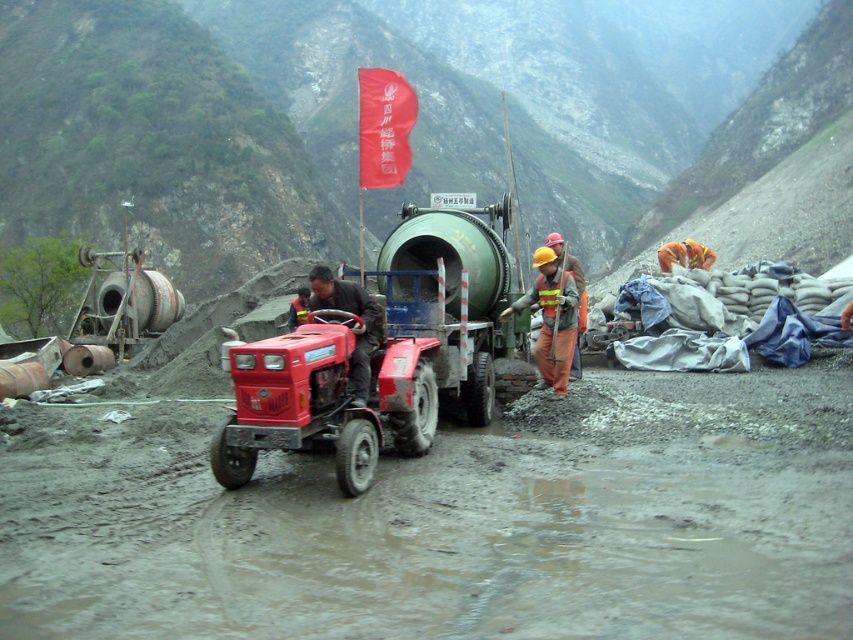
Which of these two, red matte tractor at center or red fabric flag at upper center, stands shorter?

red matte tractor at center

Which is above, red matte tractor at center or red fabric flag at upper center?

red fabric flag at upper center

Between point (247, 392) and point (364, 96), which one is positioned behind?

Point (364, 96)

At what (x,y) coordinates should I click in order to perform the action: click on red matte tractor at center. Please return your answer as a coordinate pair (x, y). The height and width of the screenshot is (640, 853). Looking at the image, I should click on (384, 356).

Is red fabric flag at upper center bigger than yellow reflective safety vest at center?

Correct, red fabric flag at upper center is larger in size than yellow reflective safety vest at center.

Who is lower down, red fabric flag at upper center or yellow reflective safety vest at center?

Positioned lower is yellow reflective safety vest at center.

What are the coordinates of `red fabric flag at upper center` in the screenshot? It's located at (384, 125).

This screenshot has height=640, width=853. Identify the location of red fabric flag at upper center. (384, 125).

Who is lower down, brown leather jacket at center or yellow reflective safety vest at center?

brown leather jacket at center is below.

Is brown leather jacket at center to the left of yellow reflective safety vest at center from the viewer's perspective?

Indeed, brown leather jacket at center is positioned on the left side of yellow reflective safety vest at center.

You are a GUI agent. You are given a task and a screenshot of the screen. Output one action in this format:
    pyautogui.click(x=<x>, y=<y>)
    Task: Click on the brown leather jacket at center
    The image size is (853, 640).
    Given the screenshot: What is the action you would take?
    point(354,314)